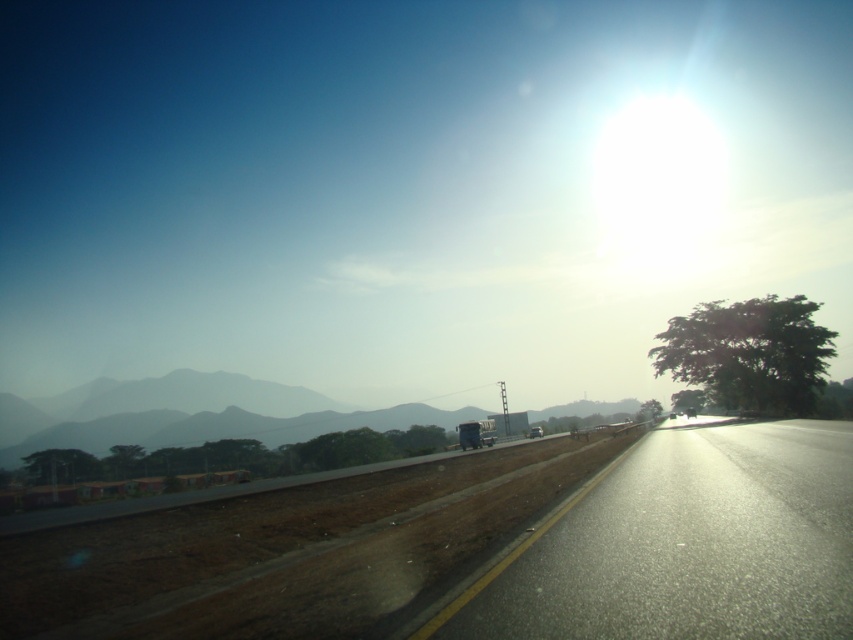
Can you confirm if metallic blue trailer truck at center is wider than metallic silver car at center?

No.

Which is more to the right, metallic blue trailer truck at center or metallic silver car at center?

Positioned to the right is metallic silver car at center.

Does point (467, 438) lie in front of point (532, 428)?

Yes, it is.

Where is `metallic blue trailer truck at center`? metallic blue trailer truck at center is located at coordinates (469, 435).

Does black asphalt highway at center appear on the left side of metallic blue trailer truck at center?

In fact, black asphalt highway at center is to the right of metallic blue trailer truck at center.

Is black asphalt highway at center shorter than metallic blue trailer truck at center?

Indeed, black asphalt highway at center has a lesser height compared to metallic blue trailer truck at center.

Identify the location of black asphalt highway at center. (688, 545).

Is black asphalt highway at center above metallic silver car at center?

Indeed, black asphalt highway at center is positioned over metallic silver car at center.

Is point (804, 496) positioned after point (531, 436)?

No, it is in front of (531, 436).

The height and width of the screenshot is (640, 853). Identify the location of black asphalt highway at center. (688, 545).